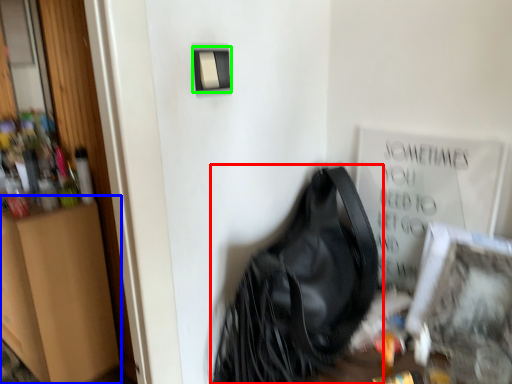
Question: Which is farther away from handbag (highlighted by a red box)? dresser (highlighted by a blue box) or light switch (highlighted by a green box)?

Choices:
 (A) dresser
 (B) light switch

Answer: (A)